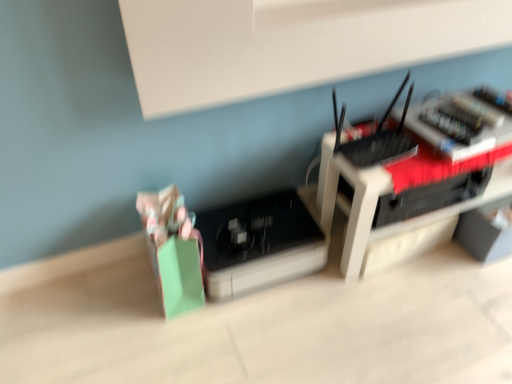
This screenshot has height=384, width=512. In order to click on vacant area that lies to the right of black plastic register at center, the 2th register from the top in this screenshot , I will do `click(362, 300)`.